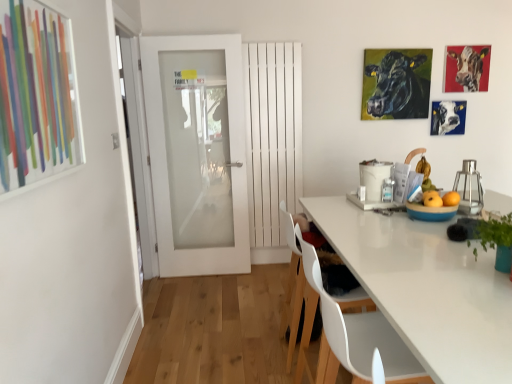
The height and width of the screenshot is (384, 512). Find the location of `free location above white matte radiator at center, arranged as the second door when viewed from the left (from a real-world perspective)`. free location above white matte radiator at center, arranged as the second door when viewed from the left (from a real-world perspective) is located at coordinates (269, 41).